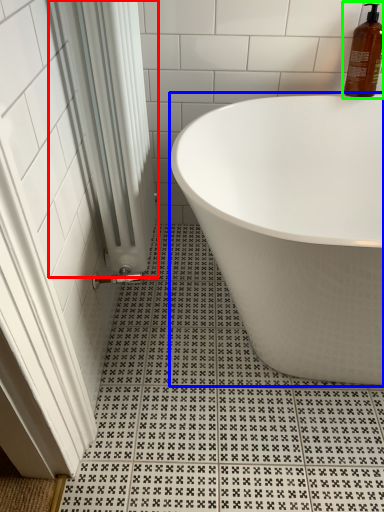
Question: Which object is the closest to the shower curtain (highlighted by a red box)? Choose among these: bathtub (highlighted by a blue box) or cleaning product (highlighted by a green box).

Choices:
 (A) bathtub
 (B) cleaning product

Answer: (A)